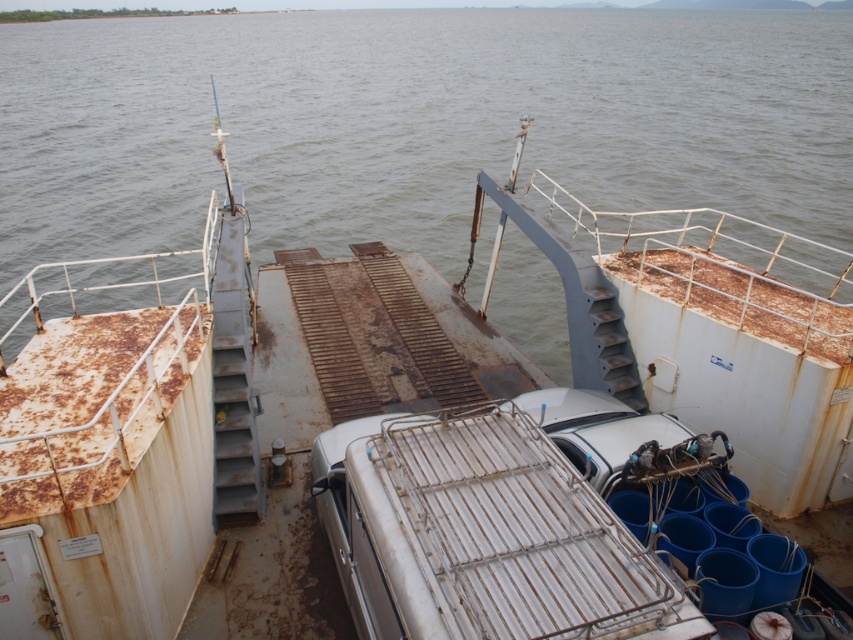
Question: Is rusty water at center further to camera compared to white matte boat at center?

Choices:
 (A) yes
 (B) no

Answer: (A)

Question: Which of the following is the closest to the observer?

Choices:
 (A) rusty water at center
 (B) white matte boat at center

Answer: (B)

Question: Can you confirm if rusty water at center is positioned to the left of white matte boat at center?

Choices:
 (A) yes
 (B) no

Answer: (A)

Question: Is rusty water at center wider than white matte boat at center?

Choices:
 (A) yes
 (B) no

Answer: (A)

Question: Which point is closer to the camera?

Choices:
 (A) (599, 120)
 (B) (578, 243)

Answer: (B)